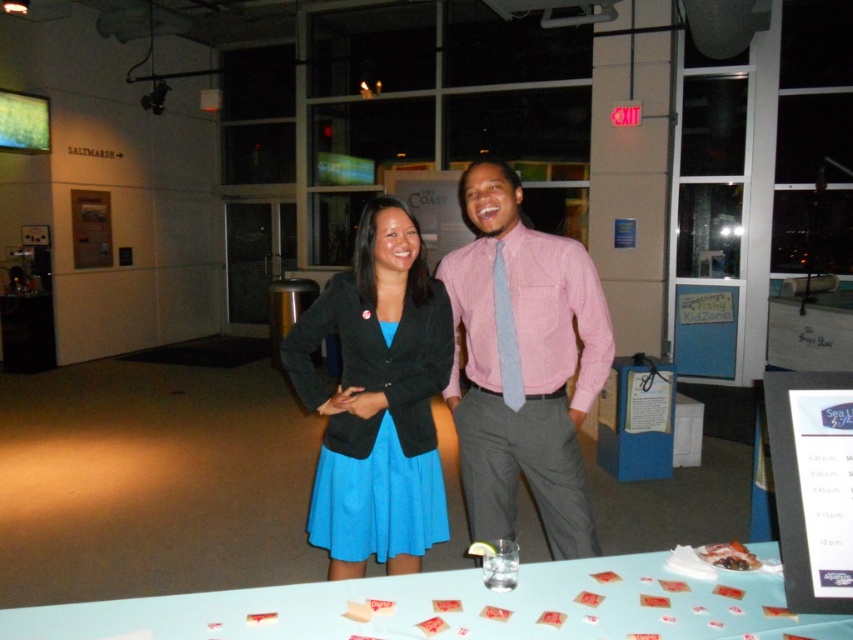
Can you confirm if light blue plastic table at center is positioned to the left of pink checkered shirt at center?

Yes, light blue plastic table at center is to the left of pink checkered shirt at center.

I want to click on light blue plastic table at center, so click(x=456, y=609).

Is pink checkered shirt at center above blue fabric dress at center?

Yes, pink checkered shirt at center is above blue fabric dress at center.

Who is positioned more to the left, pink checkered shirt at center or blue fabric dress at center?

Positioned to the left is blue fabric dress at center.

The width and height of the screenshot is (853, 640). What do you see at coordinates (521, 364) in the screenshot?
I see `pink checkered shirt at center` at bounding box center [521, 364].

Find the location of a particular element. pink checkered shirt at center is located at coordinates (521, 364).

Between light blue plastic table at center and blue fabric dress at center, which one appears on the left side from the viewer's perspective?

Positioned to the left is blue fabric dress at center.

Is point (618, 568) positioned before point (363, 465)?

Yes, it is.

At what (x,y) coordinates should I click in order to perform the action: click on light blue plastic table at center. Please return your answer as a coordinate pair (x, y). Image resolution: width=853 pixels, height=640 pixels. Looking at the image, I should click on (456, 609).